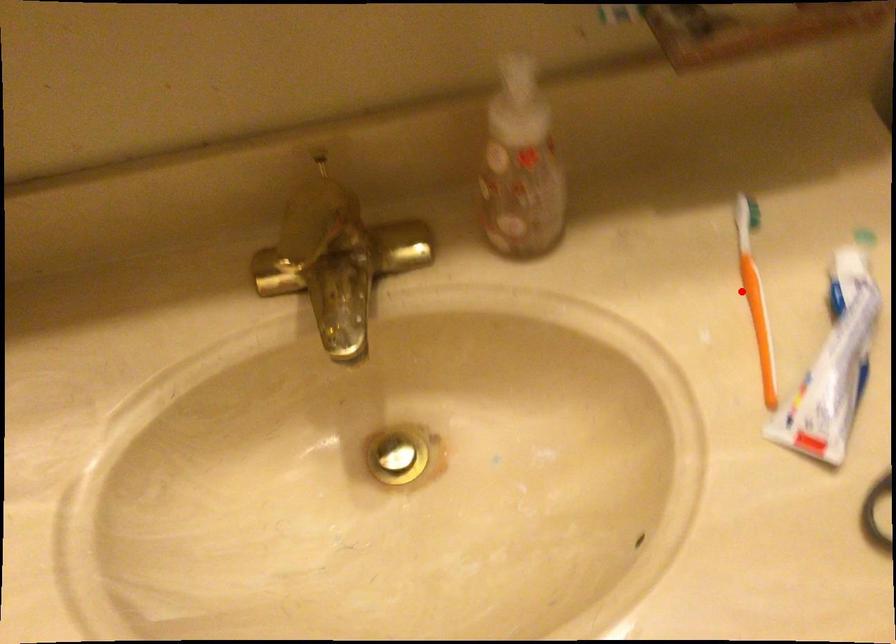
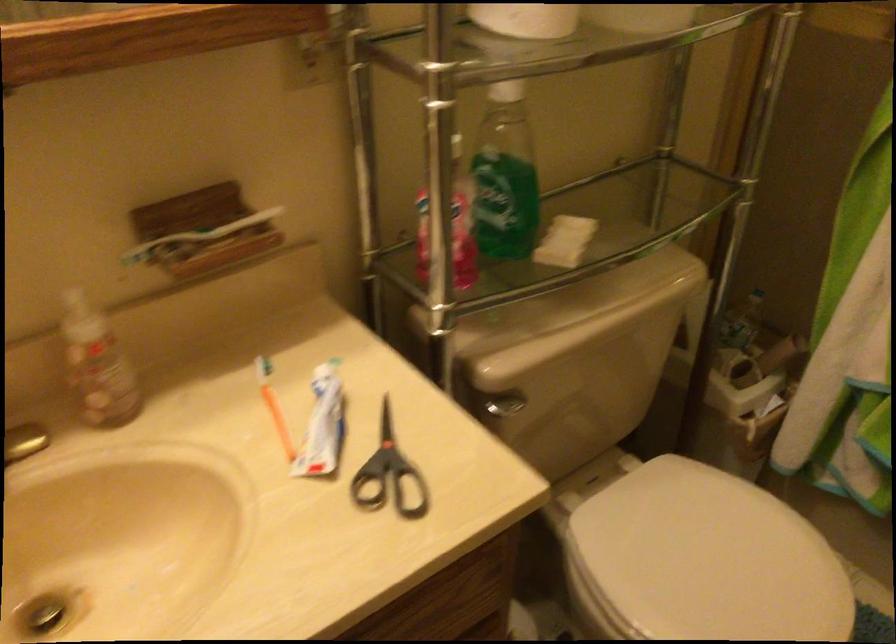
Question: I am providing you with two images of the same scene from different viewpoints. In image1, a red point is highlighted. Considering the same 3D point in image2, which of the following is correct?

Choices:
 (A) It is closer
 (B) It is farther

Answer: (B)